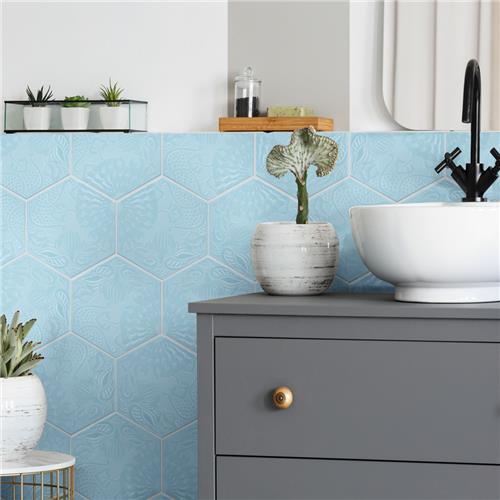
This screenshot has height=500, width=500. I want to click on drawer, so click(417, 409).